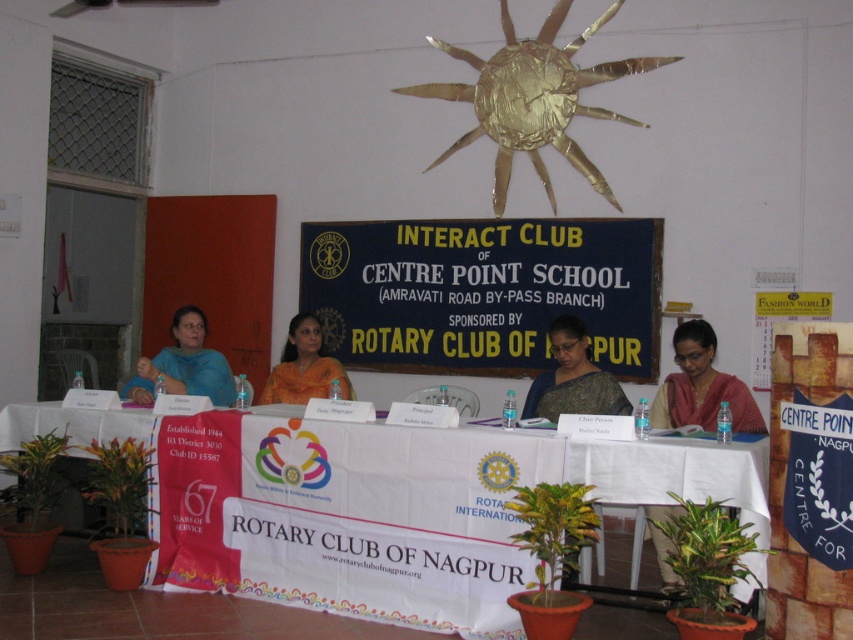
Identify the location of white cloth table at center. (463, 472).

Between white cloth table at center and matte blue sari at left, which one has less height?

Standing shorter between the two is matte blue sari at left.

Is point (410, 500) closer to viewer compared to point (225, 380)?

Yes, it is.

The width and height of the screenshot is (853, 640). Find the location of `white cloth table at center`. white cloth table at center is located at coordinates (463, 472).

Does blue fabric sign at center lie in front of matte black saree at center?

No, it is not.

Does blue fabric sign at center have a greater width compared to matte black saree at center?

Yes, blue fabric sign at center is wider than matte black saree at center.

Where is `blue fabric sign at center`? Image resolution: width=853 pixels, height=640 pixels. blue fabric sign at center is located at coordinates (483, 292).

What are the coordinates of `blue fabric sign at center` in the screenshot? It's located at (483, 292).

Who is positioned more to the left, blue fabric sign at center or matte blue sari at left?

matte blue sari at left

Does point (624, 336) lie in front of point (184, 314)?

No, (624, 336) is further to viewer.

Where is `blue fabric sign at center`? blue fabric sign at center is located at coordinates (483, 292).